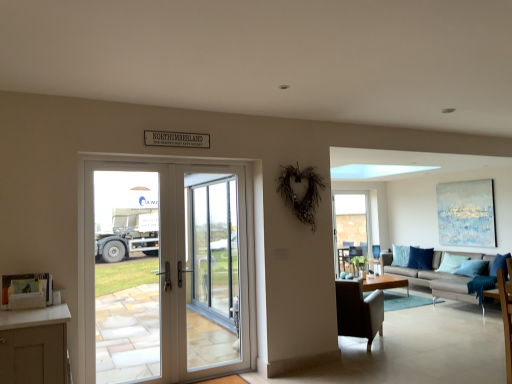
Question: From a real-world perspective, does white glossy screen door at center sit lower than white glass door at center?

Choices:
 (A) no
 (B) yes

Answer: (B)

Question: Is white glossy screen door at center looking in the opposite direction of white glass door at center?

Choices:
 (A) no
 (B) yes

Answer: (B)

Question: Considering the relative sizes of white glossy screen door at center and white glass door at center in the image provided, is white glossy screen door at center bigger than white glass door at center?

Choices:
 (A) no
 (B) yes

Answer: (A)

Question: Is white glass door at center surrounded by white glossy screen door at center?

Choices:
 (A) yes
 (B) no

Answer: (A)

Question: Is white glossy screen door at center to the left of white glass door at center from the viewer's perspective?

Choices:
 (A) yes
 (B) no

Answer: (B)

Question: Is white glossy screen door at center at the right side of white glass door at center?

Choices:
 (A) no
 (B) yes

Answer: (B)

Question: Is clear glass window at right oriented away from white glass door at center?

Choices:
 (A) yes
 (B) no

Answer: (B)

Question: Is clear glass window at right positioned before white glass door at center?

Choices:
 (A) no
 (B) yes

Answer: (A)

Question: Is clear glass window at right thinner than white glass door at center?

Choices:
 (A) yes
 (B) no

Answer: (B)

Question: Considering the relative positions of clear glass window at right and white glass door at center in the image provided, is clear glass window at right to the left of white glass door at center from the viewer's perspective?

Choices:
 (A) no
 (B) yes

Answer: (A)

Question: Is clear glass window at right surrounding white glass door at center?

Choices:
 (A) no
 (B) yes

Answer: (A)

Question: Considering the relative sizes of clear glass window at right and white glass door at center in the image provided, is clear glass window at right shorter than white glass door at center?

Choices:
 (A) no
 (B) yes

Answer: (B)

Question: Is light brown wooden coffee table at center facing towards white glass door at center?

Choices:
 (A) no
 (B) yes

Answer: (A)